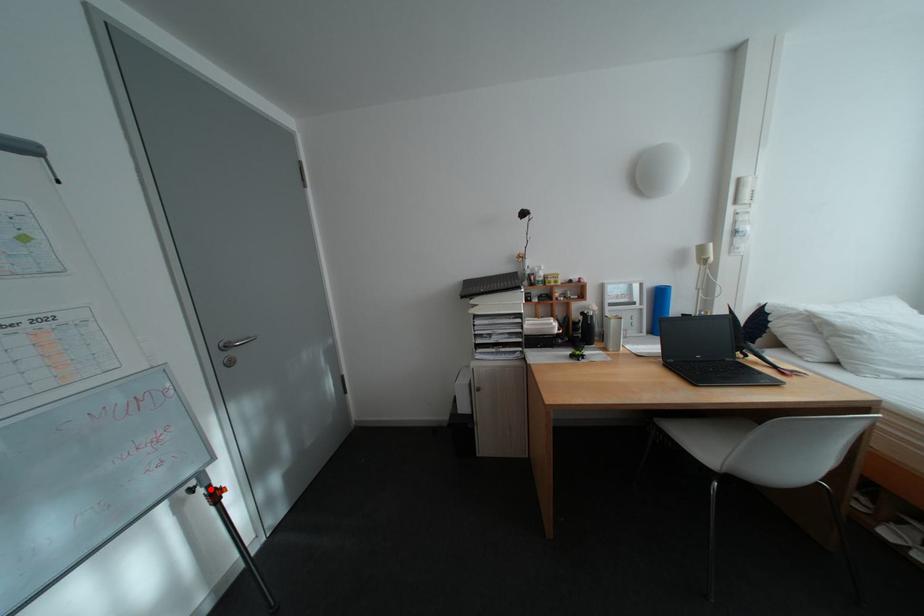
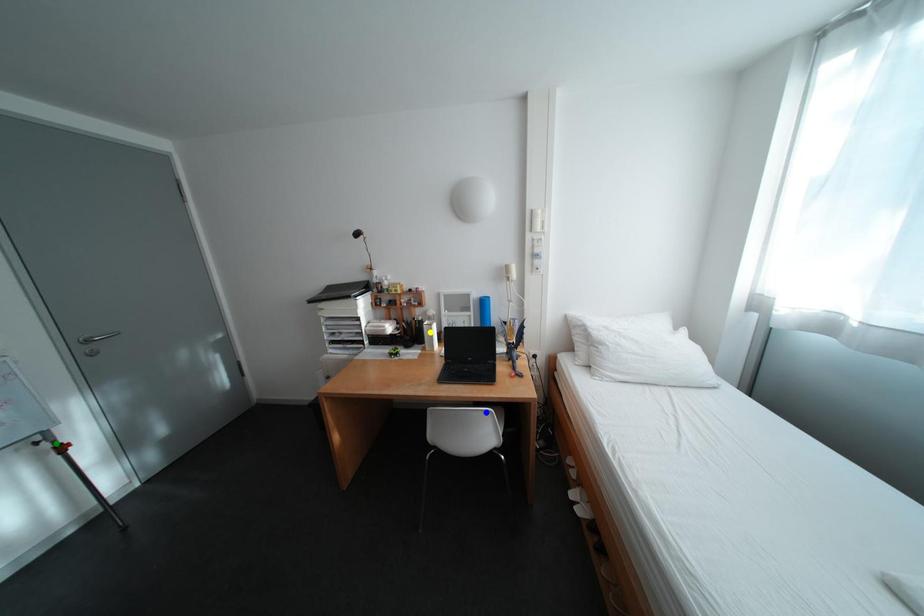
Question: I am providing you with two images of the same scene from different viewpoints. A red point is marked on the first image. You are given multiple points on the second image. Which point in image 2 represents the same 3d spot as the red point in image 1?

Choices:
 (A) blue point
 (B) green point
 (C) yellow point

Answer: (B)